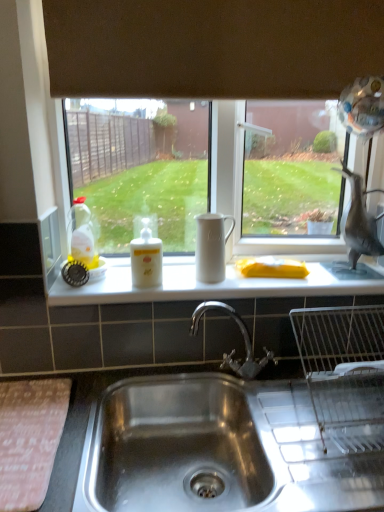
Question: Would you say brown matte exhaust hood at upper center is to the left or to the right of white matte bottle at center, the 1th bottle in the right-to-left sequence, in the picture?

Choices:
 (A) right
 (B) left

Answer: (A)

Question: In terms of width, does brown matte exhaust hood at upper center look wider or thinner when compared to white matte bottle at center, which is counted as the 2th bottle, starting from the left?

Choices:
 (A) wide
 (B) thin

Answer: (B)

Question: Which object is the farthest from the white matte jug at center?

Choices:
 (A) translucent yellow liquid at bottle left, arranged as the second bottle when viewed from the right
 (B) gray matte bird at right
 (C) brown matte exhaust hood at upper center
 (D) stainless steel sink at lower center
 (E) white matte counter top at center

Answer: (C)

Question: Considering the real-world distances, which object is closest to the gray matte bird at right?

Choices:
 (A) white matte bottle at center, which is counted as the 2th bottle, starting from the left
 (B) translucent yellow liquid at bottle left, the 1th bottle viewed from the left
 (C) stainless steel sink at lower center
 (D) white matte jug at center
 (E) white matte counter top at center

Answer: (E)